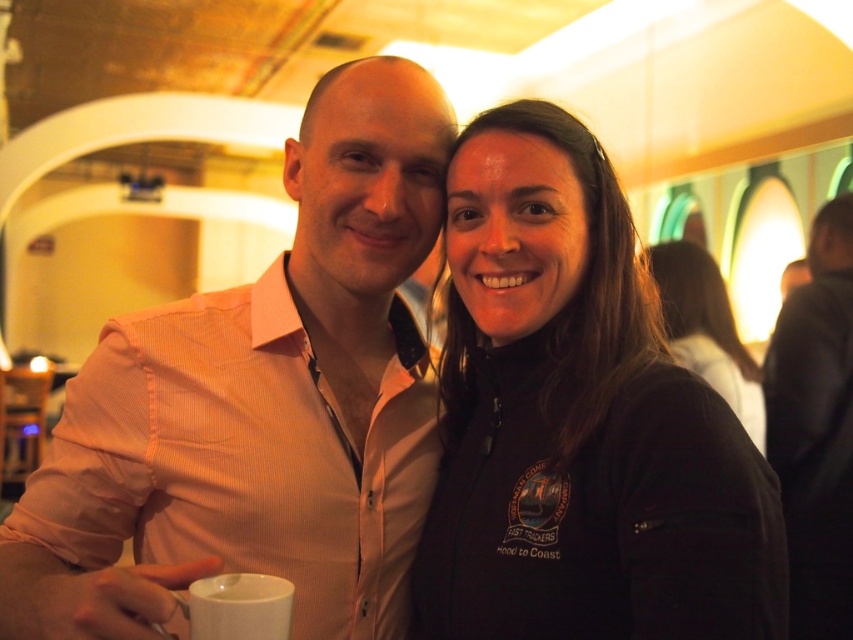
Can you confirm if pink shirt at center is taller than white matte mug at lower left?

Indeed, pink shirt at center has a greater height compared to white matte mug at lower left.

Does point (83, 538) come farther from viewer compared to point (276, 598)?

Yes.

Where is `pink shirt at center`? The height and width of the screenshot is (640, 853). pink shirt at center is located at coordinates (260, 404).

Between pink shirt at center and black leather jacket at upper right, which one appears on the left side from the viewer's perspective?

pink shirt at center is more to the left.

Can you confirm if pink shirt at center is thinner than black leather jacket at upper right?

Incorrect, pink shirt at center's width is not less than black leather jacket at upper right's.

Describe the element at coordinates (260, 404) in the screenshot. The width and height of the screenshot is (853, 640). I see `pink shirt at center` at that location.

Locate an element on the screen. The width and height of the screenshot is (853, 640). pink shirt at center is located at coordinates (260, 404).

Is black fleece jacket at center to the left of white matte mug at lower left from the viewer's perspective?

No, black fleece jacket at center is not to the left of white matte mug at lower left.

Can you confirm if black fleece jacket at center is bigger than white matte mug at lower left?

Yes, black fleece jacket at center is bigger than white matte mug at lower left.

I want to click on black fleece jacket at center, so click(x=579, y=428).